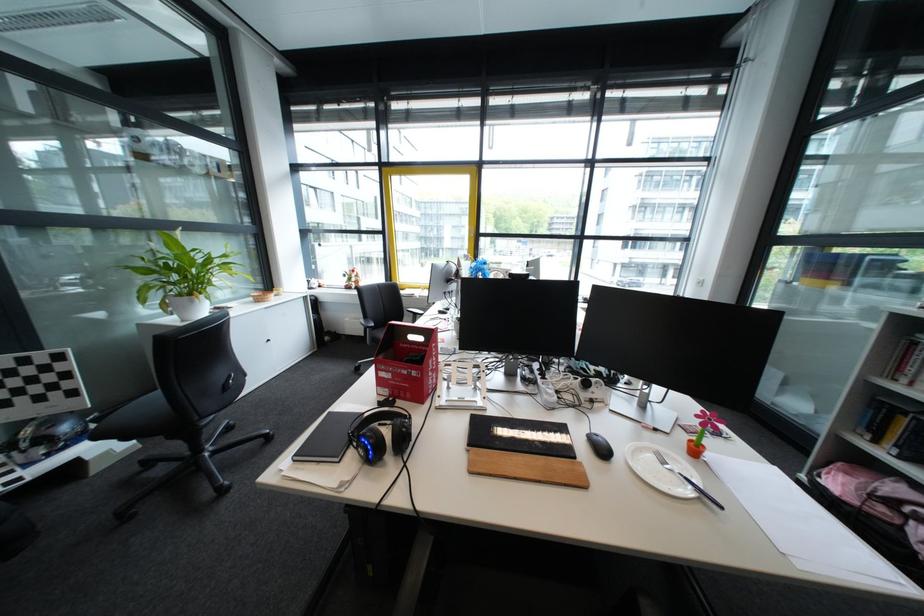
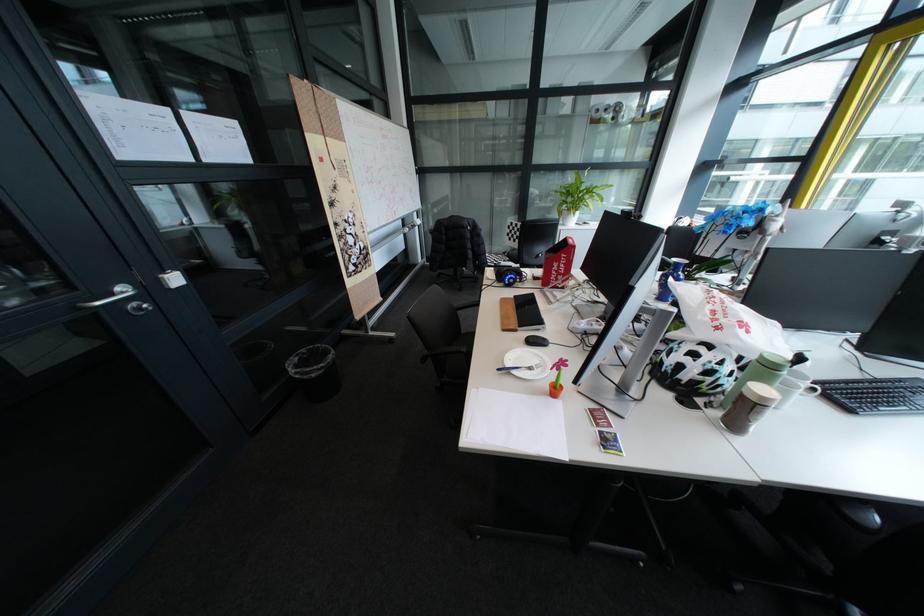
The point at (x=615, y=450) is marked in the first image. Where is the corresponding point in the second image?

(546, 342)